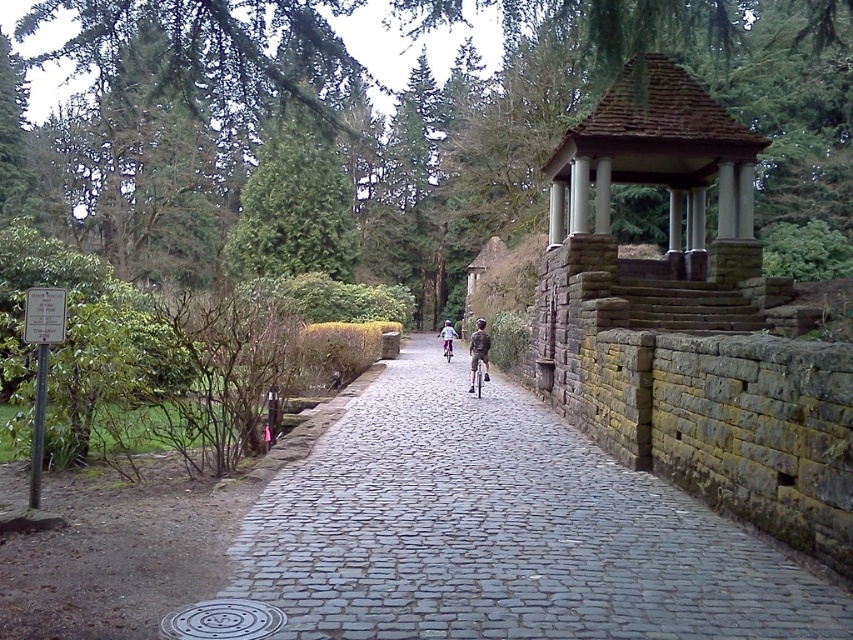
Does point (299, 522) lie behind point (485, 326)?

No, (299, 522) is in front of (485, 326).

Does cobblestone path at center have a greater height compared to khaki cotton shorts at center?

In fact, cobblestone path at center may be shorter than khaki cotton shorts at center.

This screenshot has height=640, width=853. In order to click on cobblestone path at center in this screenshot , I will do `click(491, 534)`.

Which is more to the right, khaki cotton shorts at center or light blue denim jacket at center?

Positioned to the right is khaki cotton shorts at center.

Consider the image. Can you confirm if khaki cotton shorts at center is smaller than light blue denim jacket at center?

Yes, khaki cotton shorts at center is smaller than light blue denim jacket at center.

Where is `khaki cotton shorts at center`? khaki cotton shorts at center is located at coordinates (479, 353).

Does brown stone gazebo at upper right appear on the left side of light blue denim jacket at center?

Incorrect, brown stone gazebo at upper right is not on the left side of light blue denim jacket at center.

Where is `brown stone gazebo at upper right`? This screenshot has height=640, width=853. brown stone gazebo at upper right is located at coordinates (660, 179).

Who is more forward, [741,244] or [444,332]?

Point [741,244]

Find the location of a particular element. The width and height of the screenshot is (853, 640). brown stone gazebo at upper right is located at coordinates (660, 179).